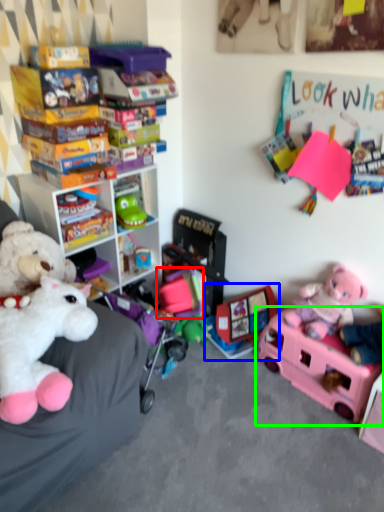
Question: Estimate the real-world distances between objects in this image. Which object is closer to toy (highlighted by a red box), toy (highlighted by a blue box) or toy (highlighted by a green box)?

Choices:
 (A) toy
 (B) toy

Answer: (A)